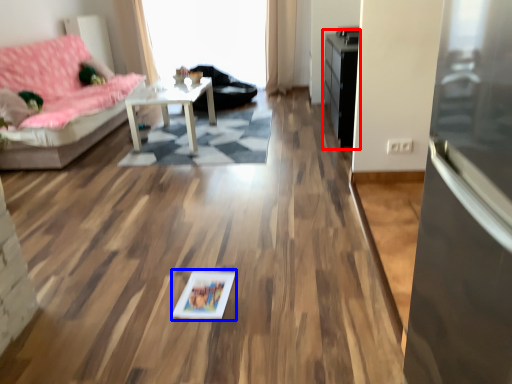
Question: Which of the following is the farthest to the observer, dresser (highlighted by a red box) or picture frame (highlighted by a blue box)?

Choices:
 (A) dresser
 (B) picture frame

Answer: (A)